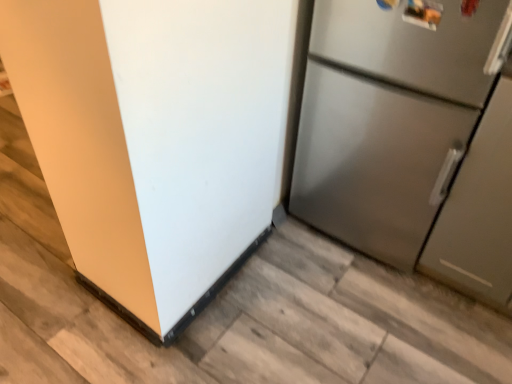
What is the approximate height of satin silver refrigerator at right, acting as the 1th refrigerator starting from the right?

The height of satin silver refrigerator at right, acting as the 1th refrigerator starting from the right, is 38.47 inches.

The width and height of the screenshot is (512, 384). What are the coordinates of `satin silver refrigerator at right, acting as the 1th refrigerator starting from the right` in the screenshot? It's located at (409, 143).

Describe the element at coordinates (409, 143) in the screenshot. Image resolution: width=512 pixels, height=384 pixels. I see `satin silver refrigerator at right, placed as the second refrigerator when sorted from left to right` at that location.

Measure the distance between stainless steel refrigerator at right, the second refrigerator in the right-to-left sequence, and camera.

stainless steel refrigerator at right, the second refrigerator in the right-to-left sequence, is 27.34 inches away from camera.

What do you see at coordinates (155, 139) in the screenshot?
I see `stainless steel refrigerator at right, positioned as the 1th refrigerator in left-to-right order` at bounding box center [155, 139].

Find the location of a particular element. Image resolution: width=512 pixels, height=384 pixels. stainless steel refrigerator at right, positioned as the 1th refrigerator in left-to-right order is located at coordinates (155, 139).

Consider the image. Measure the distance between point (176,47) and camera.

Point (176,47) and camera are 34.25 inches apart.

The height and width of the screenshot is (384, 512). I want to click on satin silver refrigerator at right, placed as the second refrigerator when sorted from left to right, so click(x=409, y=143).

Can you confirm if satin silver refrigerator at right, acting as the 1th refrigerator starting from the right, is positioned to the right of stainless steel refrigerator at right, positioned as the 1th refrigerator in left-to-right order?

Indeed, satin silver refrigerator at right, acting as the 1th refrigerator starting from the right, is positioned on the right side of stainless steel refrigerator at right, positioned as the 1th refrigerator in left-to-right order.

In the image, is satin silver refrigerator at right, acting as the 1th refrigerator starting from the right, positioned in front of or behind stainless steel refrigerator at right, positioned as the 1th refrigerator in left-to-right order?

satin silver refrigerator at right, acting as the 1th refrigerator starting from the right, is positioned farther from the viewer than stainless steel refrigerator at right, positioned as the 1th refrigerator in left-to-right order.

Considering the points (480, 61) and (137, 204), which point is behind, point (480, 61) or point (137, 204)?

The point (480, 61) is farther.

From the image's perspective, is satin silver refrigerator at right, placed as the second refrigerator when sorted from left to right, located above stainless steel refrigerator at right, the second refrigerator in the right-to-left sequence?

Yes.

From a real-world perspective, is satin silver refrigerator at right, placed as the second refrigerator when sorted from left to right, positioned under stainless steel refrigerator at right, positioned as the 1th refrigerator in left-to-right order, based on gravity?

Incorrect, from a real-world perspective, satin silver refrigerator at right, placed as the second refrigerator when sorted from left to right, is higher than stainless steel refrigerator at right, positioned as the 1th refrigerator in left-to-right order.

Can you confirm if satin silver refrigerator at right, placed as the second refrigerator when sorted from left to right, is wider than stainless steel refrigerator at right, positioned as the 1th refrigerator in left-to-right order?

Incorrect, the width of satin silver refrigerator at right, placed as the second refrigerator when sorted from left to right, does not surpass that of stainless steel refrigerator at right, positioned as the 1th refrigerator in left-to-right order.

Consider the image. Is satin silver refrigerator at right, placed as the second refrigerator when sorted from left to right, taller or shorter than stainless steel refrigerator at right, the second refrigerator in the right-to-left sequence?

satin silver refrigerator at right, placed as the second refrigerator when sorted from left to right, is taller than stainless steel refrigerator at right, the second refrigerator in the right-to-left sequence.

Is satin silver refrigerator at right, placed as the second refrigerator when sorted from left to right, bigger than stainless steel refrigerator at right, positioned as the 1th refrigerator in left-to-right order?

Correct, satin silver refrigerator at right, placed as the second refrigerator when sorted from left to right, is larger in size than stainless steel refrigerator at right, positioned as the 1th refrigerator in left-to-right order.

Is stainless steel refrigerator at right, positioned as the 1th refrigerator in left-to-right order, completely or partially inside satin silver refrigerator at right, placed as the second refrigerator when sorted from left to right?

Definitely not — stainless steel refrigerator at right, positioned as the 1th refrigerator in left-to-right order, is not inside satin silver refrigerator at right, placed as the second refrigerator when sorted from left to right.

Is satin silver refrigerator at right, placed as the second refrigerator when sorted from left to right, far away from stainless steel refrigerator at right, the second refrigerator in the right-to-left sequence?

No, satin silver refrigerator at right, placed as the second refrigerator when sorted from left to right, is in close proximity to stainless steel refrigerator at right, the second refrigerator in the right-to-left sequence.

Does satin silver refrigerator at right, acting as the 1th refrigerator starting from the right, turn towards stainless steel refrigerator at right, positioned as the 1th refrigerator in left-to-right order?

No, satin silver refrigerator at right, acting as the 1th refrigerator starting from the right, does not turn towards stainless steel refrigerator at right, positioned as the 1th refrigerator in left-to-right order.

Identify the location of refrigerator that is on the left side of satin silver refrigerator at right, placed as the second refrigerator when sorted from left to right. (155, 139).

Is stainless steel refrigerator at right, the second refrigerator in the right-to-left sequence, at the right side of satin silver refrigerator at right, acting as the 1th refrigerator starting from the right?

In fact, stainless steel refrigerator at right, the second refrigerator in the right-to-left sequence, is to the left of satin silver refrigerator at right, acting as the 1th refrigerator starting from the right.

Which is in front, stainless steel refrigerator at right, positioned as the 1th refrigerator in left-to-right order, or satin silver refrigerator at right, acting as the 1th refrigerator starting from the right?

stainless steel refrigerator at right, positioned as the 1th refrigerator in left-to-right order, is closer to the camera.

Is point (278, 112) positioned after point (339, 57)?

Yes, point (278, 112) is behind point (339, 57).

Looking at this image, from the image's perspective, which is above, stainless steel refrigerator at right, positioned as the 1th refrigerator in left-to-right order, or satin silver refrigerator at right, placed as the second refrigerator when sorted from left to right?

From the image's view, satin silver refrigerator at right, placed as the second refrigerator when sorted from left to right, is above.

From a real-world perspective, is stainless steel refrigerator at right, the second refrigerator in the right-to-left sequence, above or below satin silver refrigerator at right, acting as the 1th refrigerator starting from the right?

stainless steel refrigerator at right, the second refrigerator in the right-to-left sequence, is below satin silver refrigerator at right, acting as the 1th refrigerator starting from the right.

Considering the sizes of stainless steel refrigerator at right, positioned as the 1th refrigerator in left-to-right order, and satin silver refrigerator at right, placed as the second refrigerator when sorted from left to right, in the image, is stainless steel refrigerator at right, positioned as the 1th refrigerator in left-to-right order, wider or thinner than satin silver refrigerator at right, placed as the second refrigerator when sorted from left to right,?

Considering their sizes, stainless steel refrigerator at right, positioned as the 1th refrigerator in left-to-right order, looks broader than satin silver refrigerator at right, placed as the second refrigerator when sorted from left to right.

Is stainless steel refrigerator at right, positioned as the 1th refrigerator in left-to-right order, taller than satin silver refrigerator at right, acting as the 1th refrigerator starting from the right?

Incorrect, the height of stainless steel refrigerator at right, positioned as the 1th refrigerator in left-to-right order, is not larger of that of satin silver refrigerator at right, acting as the 1th refrigerator starting from the right.

Is stainless steel refrigerator at right, positioned as the 1th refrigerator in left-to-right order, smaller than satin silver refrigerator at right, acting as the 1th refrigerator starting from the right?

Correct, stainless steel refrigerator at right, positioned as the 1th refrigerator in left-to-right order, occupies less space than satin silver refrigerator at right, acting as the 1th refrigerator starting from the right.

Is satin silver refrigerator at right, acting as the 1th refrigerator starting from the right, inside stainless steel refrigerator at right, the second refrigerator in the right-to-left sequence?

No, stainless steel refrigerator at right, the second refrigerator in the right-to-left sequence, does not contain satin silver refrigerator at right, acting as the 1th refrigerator starting from the right.

Are stainless steel refrigerator at right, the second refrigerator in the right-to-left sequence, and satin silver refrigerator at right, placed as the second refrigerator when sorted from left to right, located far from each other?

That's not correct — stainless steel refrigerator at right, the second refrigerator in the right-to-left sequence, is a little close to satin silver refrigerator at right, placed as the second refrigerator when sorted from left to right.

Is stainless steel refrigerator at right, positioned as the 1th refrigerator in left-to-right order, facing away from satin silver refrigerator at right, placed as the second refrigerator when sorted from left to right?

stainless steel refrigerator at right, positioned as the 1th refrigerator in left-to-right order, does not have its back to satin silver refrigerator at right, placed as the second refrigerator when sorted from left to right.

Consider the image. How much distance is there between stainless steel refrigerator at right, the second refrigerator in the right-to-left sequence, and satin silver refrigerator at right, placed as the second refrigerator when sorted from left to right?

stainless steel refrigerator at right, the second refrigerator in the right-to-left sequence, is 20.76 inches away from satin silver refrigerator at right, placed as the second refrigerator when sorted from left to right.

You are a GUI agent. You are given a task and a screenshot of the screen. Output one action in this format:
    pyautogui.click(x=<x>, y=<y>)
    Task: Click on the refrigerator located in front of the satin silver refrigerator at right, placed as the second refrigerator when sorted from left to right
    The height and width of the screenshot is (384, 512).
    Given the screenshot: What is the action you would take?
    pyautogui.click(x=155, y=139)

Locate an element on the screen. The width and height of the screenshot is (512, 384). refrigerator in front of the satin silver refrigerator at right, acting as the 1th refrigerator starting from the right is located at coordinates (155, 139).

Locate an element on the screen. Image resolution: width=512 pixels, height=384 pixels. refrigerator that appears on the right of stainless steel refrigerator at right, positioned as the 1th refrigerator in left-to-right order is located at coordinates (409, 143).